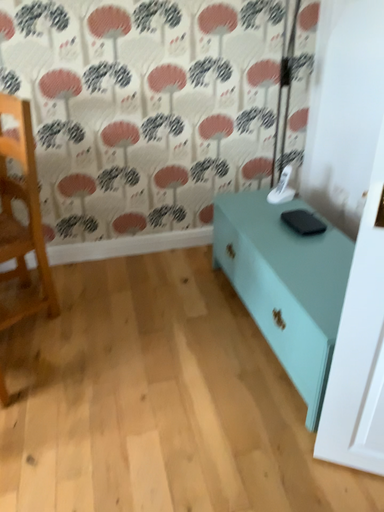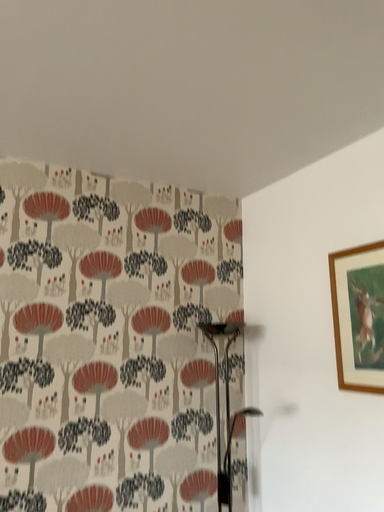
Question: Which way did the camera rotate in the video?

Choices:
 (A) rotated downward
 (B) rotated upward

Answer: (B)